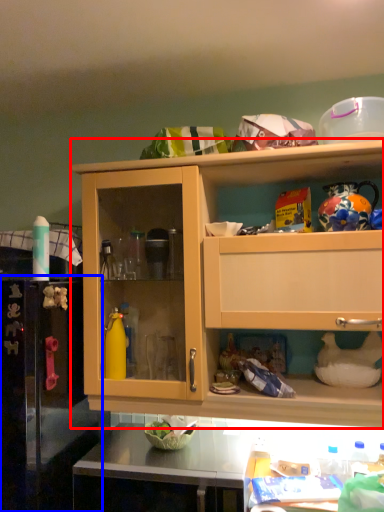
Question: Which object is closer to the camera taking this photo, cabinetry (highlighted by a red box) or appliance (highlighted by a blue box)?

Choices:
 (A) cabinetry
 (B) appliance

Answer: (B)